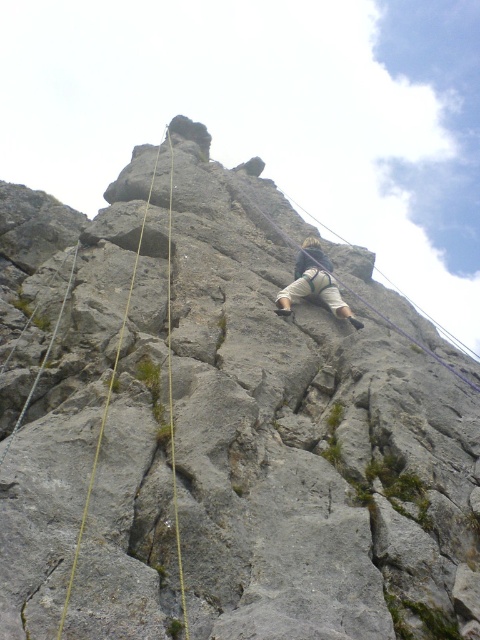
Based on the photo, you are a safety inspector assessing the rock climbing setup. The ropes must be at least 15 meters long to ensure safety. Based on the image, can you determine if the yellow rope at center is long enough to safely secure the tan fabric pants at center?

The distance between the tan fabric pants at center and yellow rope at center is 14.78 meters, which is slightly shorter than the required 15 meters. Therefore, the yellow rope at center may not be long enough to safely secure the tan fabric pants at center.

You are standing at the base of the cliff and want to reach a specific point marked as point (x=325, y=257) on the cliff face. If you have a grappling hook with a rope that can extend up to 100 feet, will it be sufficient to reach that point?

The distance of point (x=325, y=257) from viewer is 97.75 feet, so the grappling hook with a 100 feet rope will be sufficient to reach that point.

You are a photographer standing at the base of the cliff. You want to capture a closeup shot of the tan fabric pants at center. Given that your camera has a maximum zoom range of 100 feet, will you be able to achieve this?

The tan fabric pants at center is 78.36 feet away from camera. Since the camera can zoom up to 100 feet, the photographer can achieve the closeup shot.